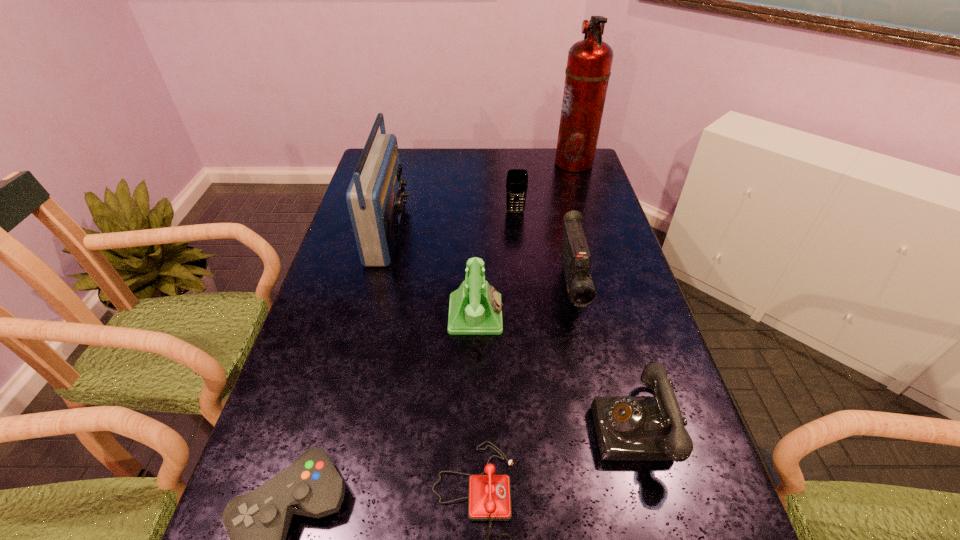
Identify the location of camcorder that is at the right edge. The width and height of the screenshot is (960, 540). (576, 259).

Find the location of a particular element. telephone that is at the right edge is located at coordinates pos(629,428).

The width and height of the screenshot is (960, 540). I want to click on object situated at the far right corner, so click(589, 62).

You are a GUI agent. You are given a task and a screenshot of the screen. Output one action in this format:
    pyautogui.click(x=<x>, y=<y>)
    Task: Click on the vacant space at the far edge of the desktop
    
    Given the screenshot: What is the action you would take?
    pyautogui.click(x=495, y=152)

Where is `free spot at the left edge of the desktop`? Image resolution: width=960 pixels, height=540 pixels. free spot at the left edge of the desktop is located at coordinates (316, 370).

At what (x,y) coordinates should I click in order to perform the action: click on free space between the camcorder and the farthest telephone. Please return your answer as a coordinate pair (x, y). The height and width of the screenshot is (540, 960). Looking at the image, I should click on (523, 301).

This screenshot has width=960, height=540. I want to click on vacant area that lies between the fire extinguisher and the cellular telephone, so pos(544,187).

Image resolution: width=960 pixels, height=540 pixels. In order to click on free space between the farthest telephone and the camcorder in this screenshot , I will do `click(523, 301)`.

Identify the location of object that can be found as the seventh closest to the seventh shortest object. This screenshot has height=540, width=960. (629, 428).

Locate which object is the second closest to the radio receiver. Please provide its 2D coordinates. Your answer should be formatted as a tuple, i.e. [(x, y)], where the tuple contains the x and y coordinates of a point satisfying the conditions above.

[(517, 179)]